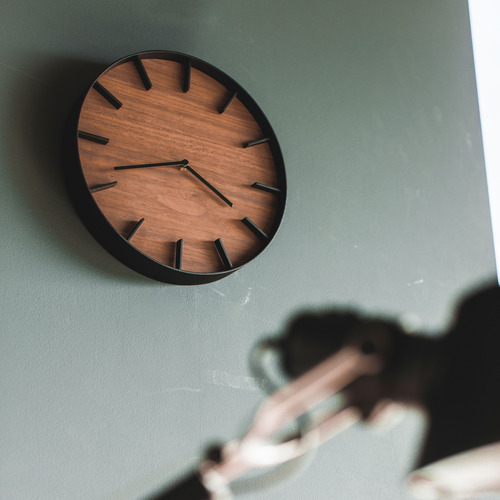
This screenshot has height=500, width=500. In order to click on clock frame in this screenshot , I will do `click(131, 258)`.